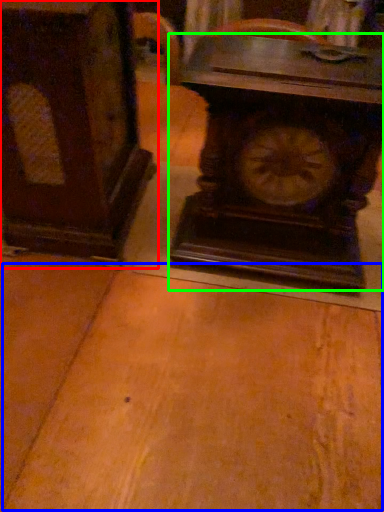
Question: Which is farther away from furniture (highlighted by a red box)? table (highlighted by a blue box) or wall clock (highlighted by a green box)?

Choices:
 (A) table
 (B) wall clock

Answer: (A)